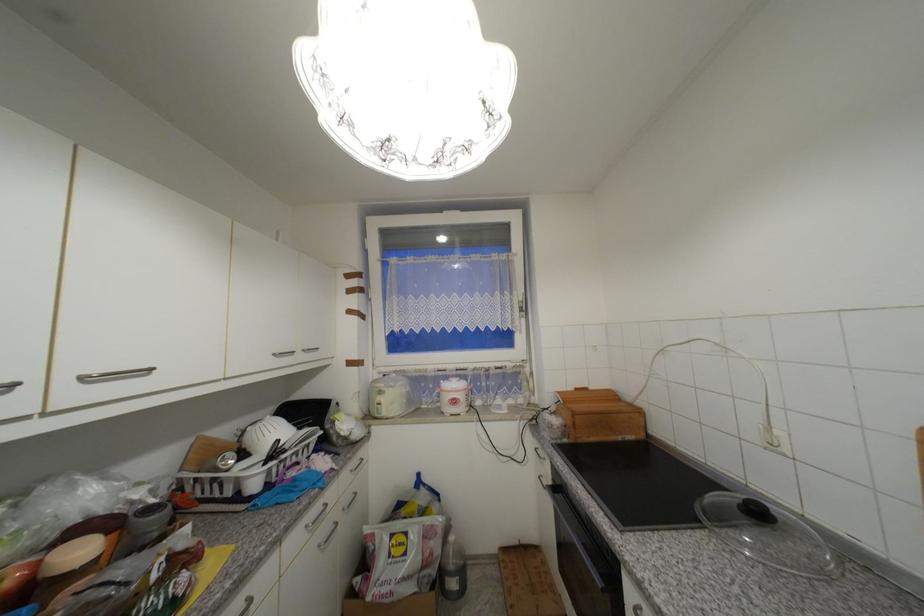
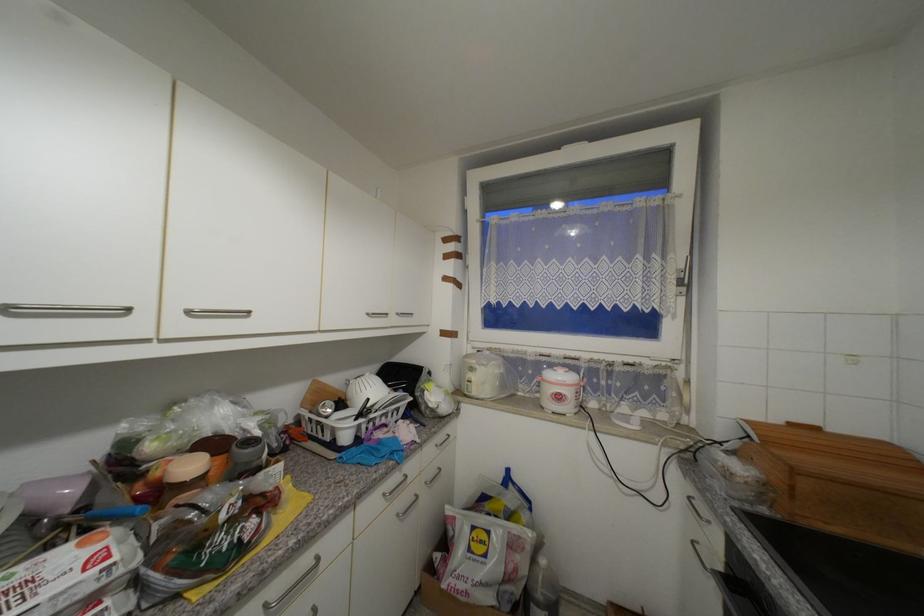
Question: The images are taken continuously from a first-person perspective. In which direction are you moving?

Choices:
 (A) Left
 (B) Right
 (C) Forward
 (D) Backward

Answer: (C)